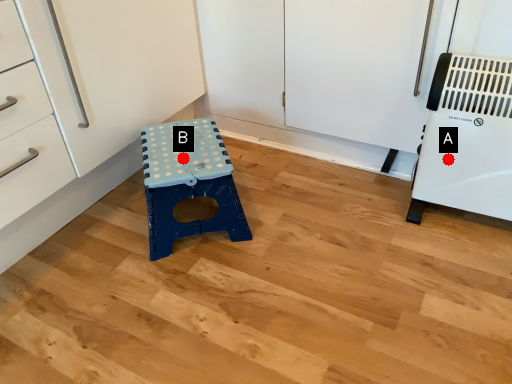
Question: Two points are circled on the image, labeled by A and B beside each circle. Which point appears farthest from the camera in this image?

Choices:
 (A) A is further
 (B) B is further

Answer: (B)